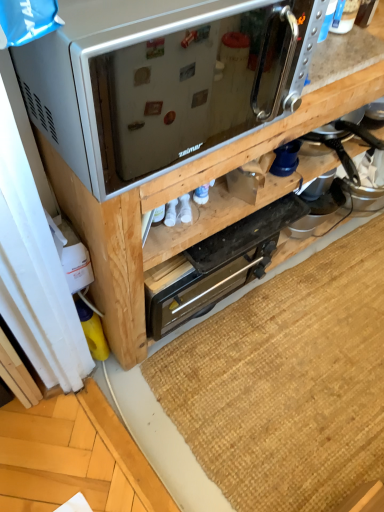
Question: From a real-world perspective, is metallic silver toaster oven at upper center located beneath brown woven mat at lower center?

Choices:
 (A) no
 (B) yes

Answer: (A)

Question: Is metallic silver toaster oven at upper center with brown woven mat at lower center?

Choices:
 (A) yes
 (B) no

Answer: (B)

Question: Is metallic silver toaster oven at upper center closer to the viewer compared to brown woven mat at lower center?

Choices:
 (A) yes
 (B) no

Answer: (A)

Question: From the image's perspective, does metallic silver toaster oven at upper center appear lower than brown woven mat at lower center?

Choices:
 (A) no
 (B) yes

Answer: (A)

Question: Considering the relative sizes of metallic silver toaster oven at upper center and brown woven mat at lower center in the image provided, is metallic silver toaster oven at upper center thinner than brown woven mat at lower center?

Choices:
 (A) no
 (B) yes

Answer: (B)

Question: Relative to black metallic toaster oven at center, is satin silver microwave at upper center in front or behind?

Choices:
 (A) front
 (B) behind

Answer: (A)

Question: From the image's perspective, is satin silver microwave at upper center located above or below black metallic toaster oven at center?

Choices:
 (A) below
 (B) above

Answer: (B)

Question: In terms of height, does satin silver microwave at upper center look taller or shorter compared to black metallic toaster oven at center?

Choices:
 (A) short
 (B) tall

Answer: (A)

Question: From a real-world perspective, relative to black metallic toaster oven at center, is satin silver microwave at upper center vertically above or below?

Choices:
 (A) below
 (B) above

Answer: (B)

Question: Is metallic silver toaster oven at upper center in front of or behind black metallic toaster oven at center in the image?

Choices:
 (A) behind
 (B) front

Answer: (B)

Question: Considering the positions of metallic silver toaster oven at upper center and black metallic toaster oven at center in the image, is metallic silver toaster oven at upper center taller or shorter than black metallic toaster oven at center?

Choices:
 (A) tall
 (B) short

Answer: (A)

Question: Based on their positions, is metallic silver toaster oven at upper center located to the left or right of black metallic toaster oven at center?

Choices:
 (A) left
 (B) right

Answer: (B)

Question: Does point (89, 147) appear closer or farther from the camera than point (152, 267)?

Choices:
 (A) closer
 (B) farther

Answer: (A)

Question: Visually, is black metallic toaster oven at center positioned to the left or to the right of satin silver microwave at upper center?

Choices:
 (A) left
 (B) right

Answer: (B)

Question: Is point (243, 236) positioned closer to the camera than point (134, 169)?

Choices:
 (A) farther
 (B) closer

Answer: (A)